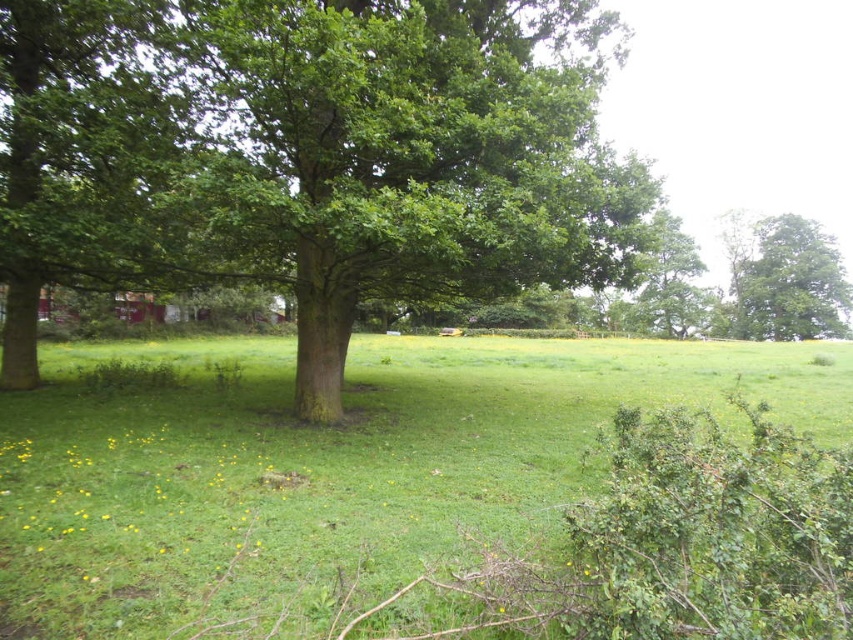
You are a gardener who wants to plant a new flower bed between the green smooth tree at center and the green grass at center. Considering their height difference, which area would be more suitable for the flowers to receive adequate sunlight?

The green grass at center is much shorter than the green smooth tree at center, so planting the flower bed in the area closer to the green grass at center would allow the flowers to receive more sunlight since they won